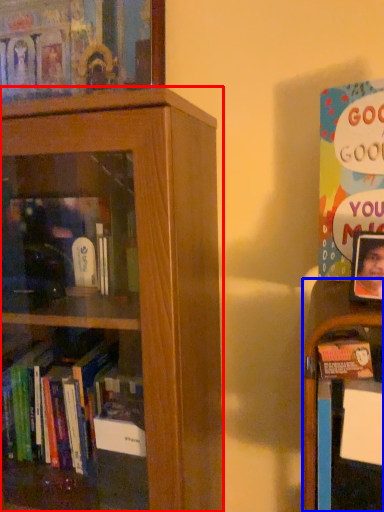
Question: Which object is further to the camera taking this photo, bookcase (highlighted by a red box) or shelf (highlighted by a blue box)?

Choices:
 (A) bookcase
 (B) shelf

Answer: (B)